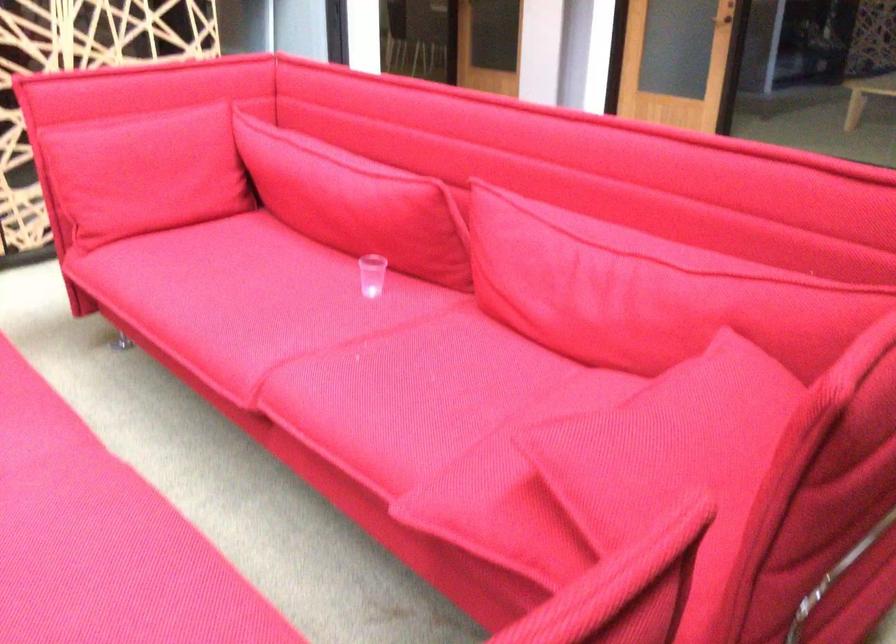
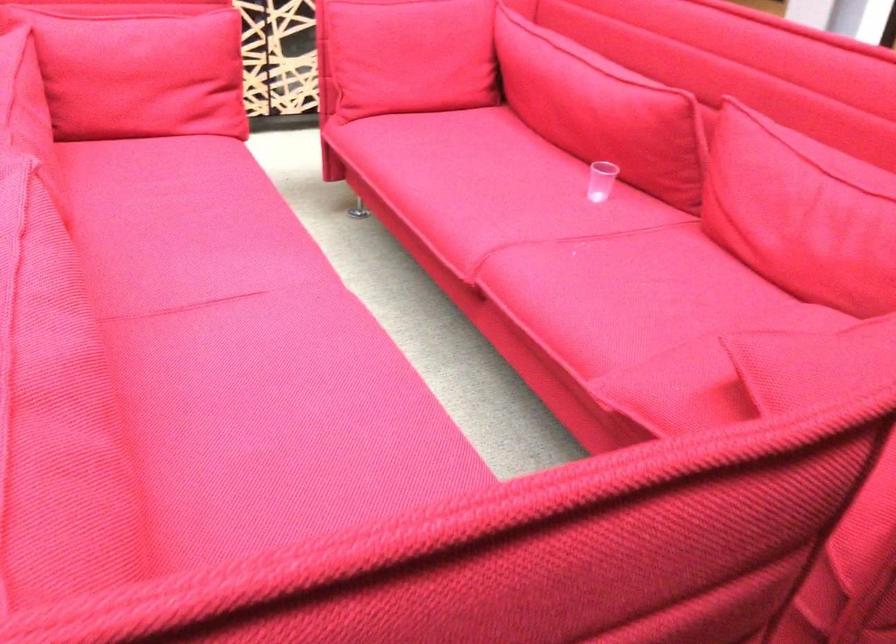
Find the pixel in the second image that matches pixel 371 275 in the first image.

(600, 180)